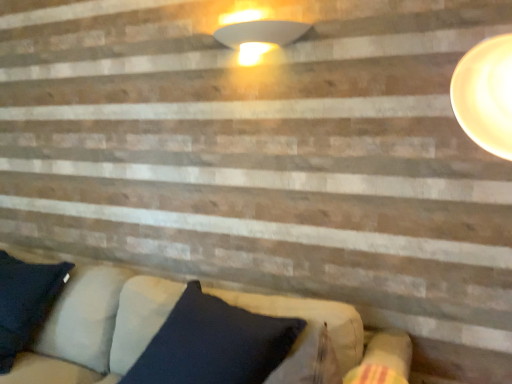
Question: Does velvet dark blue pillow at lower center appear on the left side of white glossy lampshade at upper center?

Choices:
 (A) yes
 (B) no

Answer: (B)

Question: Considering the relative sizes of velvet dark blue pillow at lower center and white glossy lampshade at upper center in the image provided, is velvet dark blue pillow at lower center thinner than white glossy lampshade at upper center?

Choices:
 (A) yes
 (B) no

Answer: (B)

Question: Is velvet dark blue pillow at lower center in front of white glossy lampshade at upper center?

Choices:
 (A) no
 (B) yes

Answer: (B)

Question: Does velvet dark blue pillow at lower center have a lesser height compared to white glossy lampshade at upper center?

Choices:
 (A) yes
 (B) no

Answer: (B)

Question: Is velvet dark blue pillow at lower center surrounding white glossy lampshade at upper center?

Choices:
 (A) no
 (B) yes

Answer: (A)

Question: From the image's perspective, is velvet dark blue pillow at lower center located beneath white glossy lampshade at upper center?

Choices:
 (A) no
 (B) yes

Answer: (B)

Question: Is white glossy lampshade at upper center bigger than velvet dark blue pillow at lower center?

Choices:
 (A) yes
 (B) no

Answer: (B)

Question: Is white glossy lampshade at upper center far away from velvet dark blue pillow at lower center?

Choices:
 (A) no
 (B) yes

Answer: (B)

Question: Is velvet dark blue pillow at lower center inside white glossy lampshade at upper center?

Choices:
 (A) no
 (B) yes

Answer: (A)

Question: Does white glossy lampshade at upper center appear on the right side of velvet dark blue pillow at lower center?

Choices:
 (A) yes
 (B) no

Answer: (B)

Question: Does white glossy lampshade at upper center appear on the left side of velvet dark blue pillow at lower center?

Choices:
 (A) no
 (B) yes

Answer: (B)

Question: Can you confirm if white glossy lampshade at upper center is wider than velvet dark blue pillow at lower center?

Choices:
 (A) yes
 (B) no

Answer: (B)

Question: Is white glossy lampshade at upper center spatially inside velvet dark blue pillow at lower center, or outside of it?

Choices:
 (A) inside
 (B) outside

Answer: (B)